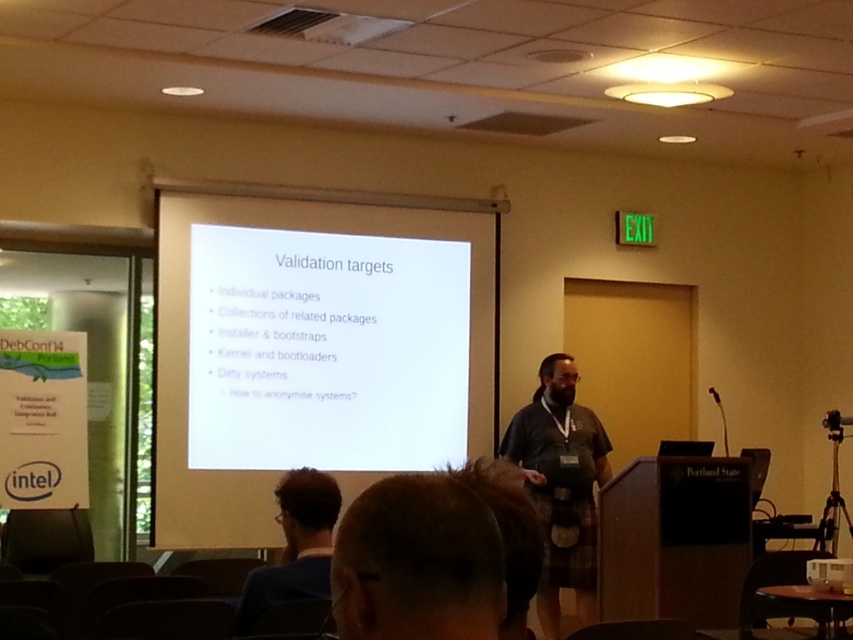
Is white matte projection screen at center closer to camera compared to black fabric shirt at center?

That is False.

Can you confirm if white matte projection screen at center is positioned to the left of black fabric shirt at center?

Correct, you'll find white matte projection screen at center to the left of black fabric shirt at center.

Who is more distant from viewer, (401, 244) or (543, 433)?

Positioned behind is point (401, 244).

At what (x,y) coordinates should I click in order to perform the action: click on white matte projection screen at center. Please return your answer as a coordinate pair (x, y). Looking at the image, I should click on (312, 346).

Which is behind, point (344, 500) or point (316, 483)?

The point (344, 500) is more distant.

Can you confirm if white matte projection screen at center is positioned below dark blue fabric at lower left?

No, white matte projection screen at center is not below dark blue fabric at lower left.

Where is `white matte projection screen at center`? Image resolution: width=853 pixels, height=640 pixels. white matte projection screen at center is located at coordinates (312, 346).

Is black fabric shirt at center wider than dark blue fabric at lower left?

Indeed, black fabric shirt at center has a greater width compared to dark blue fabric at lower left.

Which is more to the left, black fabric shirt at center or dark blue fabric at lower left?

dark blue fabric at lower left is more to the left.

Is point (569, 364) positioned in front of point (282, 563)?

No, (569, 364) is further to viewer.

I want to click on black fabric shirt at center, so click(561, 484).